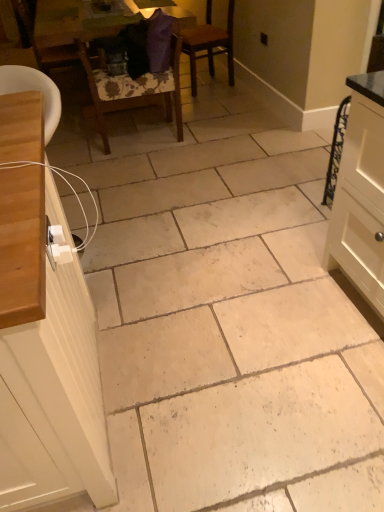
Find the location of `vacant point to the right of white matte cabinet at left`. vacant point to the right of white matte cabinet at left is located at coordinates (217, 354).